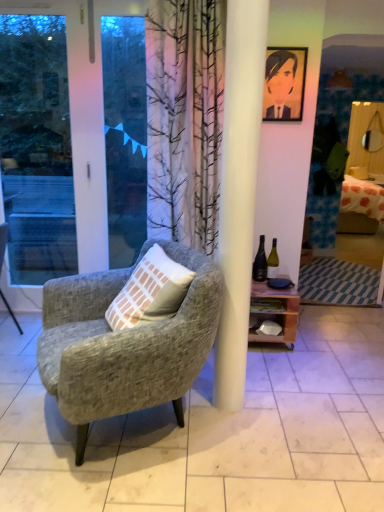
Question: Is wooden at right facing towards textured gray armchair at left, the 2th chair in the right-to-left sequence?

Choices:
 (A) yes
 (B) no

Answer: (B)

Question: Is the position of wooden at right more distant than that of textured gray armchair at left, the 2th chair in the right-to-left sequence?

Choices:
 (A) yes
 (B) no

Answer: (A)

Question: Is wooden at right not near textured gray armchair at left, which ranks as the 1th chair in left-to-right order?

Choices:
 (A) no
 (B) yes

Answer: (B)

Question: From a real-world perspective, is wooden at right over textured gray armchair at left, which ranks as the 1th chair in left-to-right order?

Choices:
 (A) no
 (B) yes

Answer: (A)

Question: Is textured gray armchair at left, the 2th chair in the right-to-left sequence, a part of wooden at right?

Choices:
 (A) no
 (B) yes

Answer: (A)

Question: From the image's perspective, is wooden at right located above textured gray armchair at left, the 2th chair in the right-to-left sequence?

Choices:
 (A) no
 (B) yes

Answer: (A)

Question: Could you tell me if textured gray armchair at center, acting as the first chair starting from the right, is facing textured gray armchair at left, the 2th chair in the right-to-left sequence?

Choices:
 (A) yes
 (B) no

Answer: (B)

Question: Is textured gray armchair at center, acting as the first chair starting from the right, behind textured gray armchair at left, which ranks as the 1th chair in left-to-right order?

Choices:
 (A) yes
 (B) no

Answer: (B)

Question: Considering the relative positions of textured gray armchair at center, the 2th chair in the left-to-right sequence, and textured gray armchair at left, the 2th chair in the right-to-left sequence, in the image provided, is textured gray armchair at center, the 2th chair in the left-to-right sequence, to the right of textured gray armchair at left, the 2th chair in the right-to-left sequence, from the viewer's perspective?

Choices:
 (A) yes
 (B) no

Answer: (A)

Question: Is textured gray armchair at center, acting as the first chair starting from the right, smaller than textured gray armchair at left, which ranks as the 1th chair in left-to-right order?

Choices:
 (A) no
 (B) yes

Answer: (A)

Question: Would you say textured gray armchair at center, acting as the first chair starting from the right, is outside textured gray armchair at left, which ranks as the 1th chair in left-to-right order?

Choices:
 (A) yes
 (B) no

Answer: (A)

Question: Does textured gray armchair at center, acting as the first chair starting from the right, have a lesser width compared to textured gray armchair at left, which ranks as the 1th chair in left-to-right order?

Choices:
 (A) no
 (B) yes

Answer: (A)

Question: Is textured gray armchair at center, acting as the first chair starting from the right, not inside white glass bottle at right, which ranks as the first bottle in right-to-left order?

Choices:
 (A) no
 (B) yes

Answer: (B)